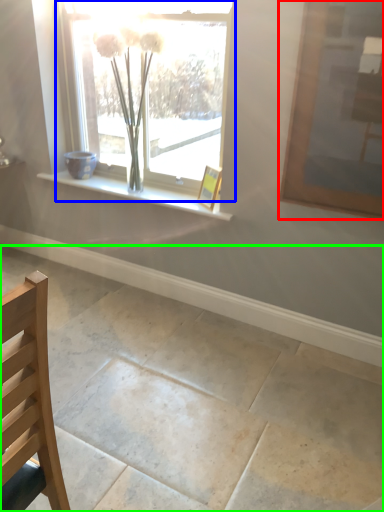
Question: Which object is the closest to the picture frame (highlighted by a red box)? Choose among these: window (highlighted by a blue box) or concrete (highlighted by a green box).

Choices:
 (A) window
 (B) concrete

Answer: (A)